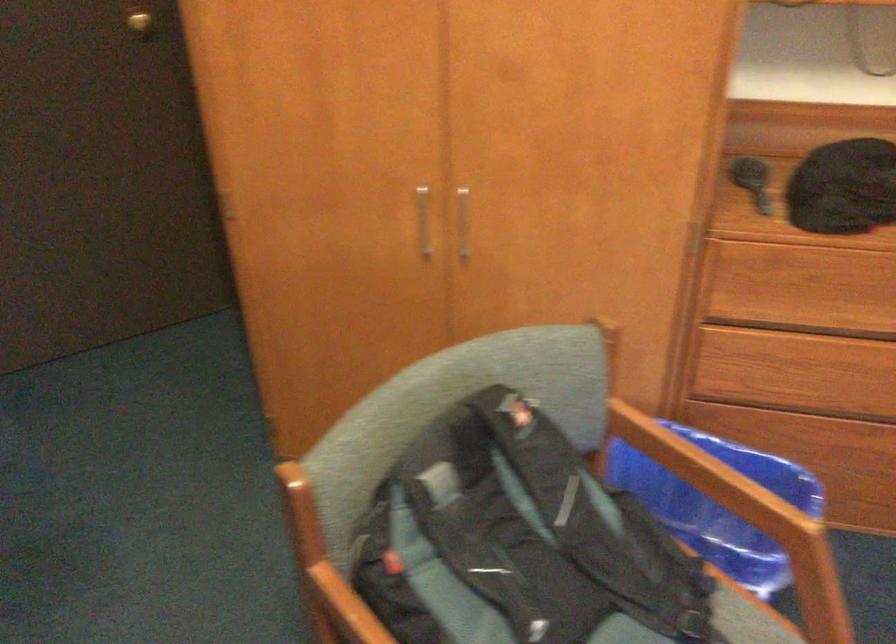
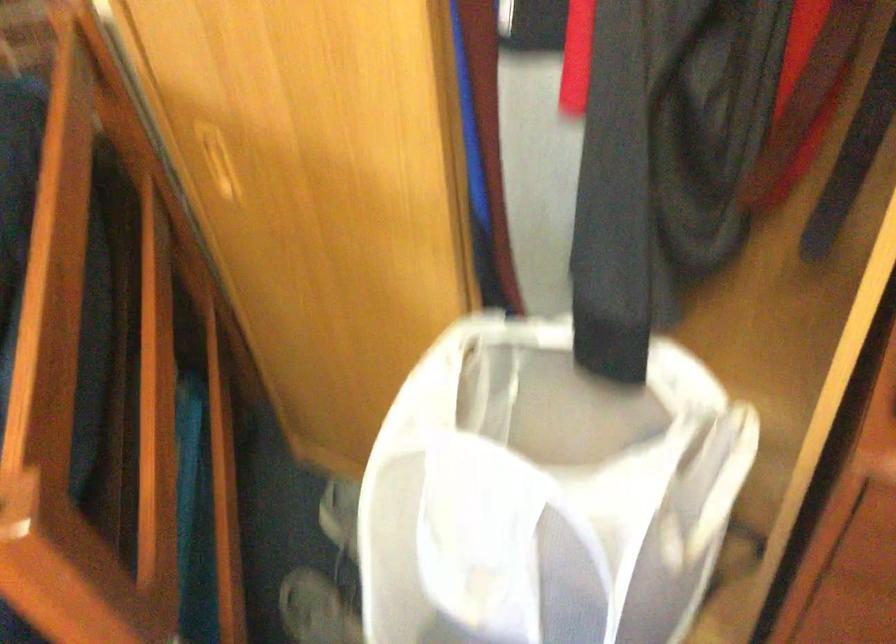
The images are taken continuously from a first-person perspective. In which direction is your viewpoint rotating?

The camera rotated toward left-down.